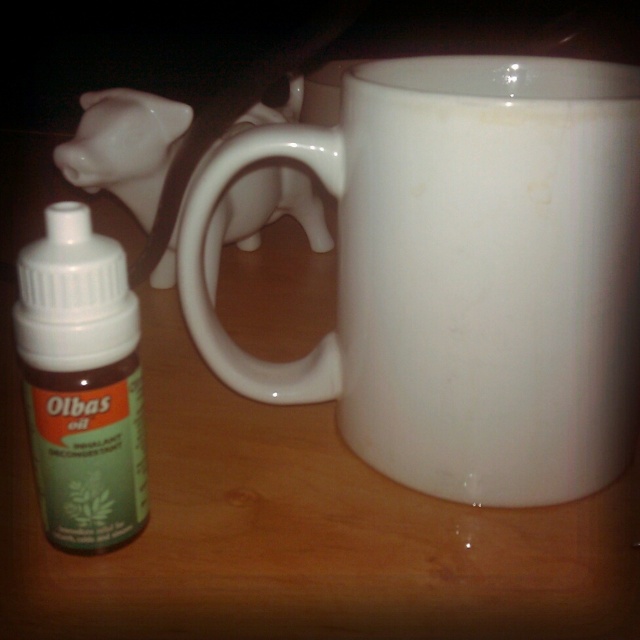
In the scene shown: You are organizing a small table and need to place the white glossy mug at center and the green matte bottle at left. According to the image, which object is placed higher than the other?

The white glossy mug at center is positioned over the green matte bottle at left, so it is higher.

You are trying to place a decorative item on the wooden surface where the white glossy mug at center is located. If you want to place it exactly at the mug position, what coordinates should you target?

You should target the coordinates at point (464, 273) where the white glossy mug at center is located.

You have a small wooden shelf that can only hold items up to the width of the green matte bottle at left. Can the white glossy mug at center fit on the shelf?

The white glossy mug at center is wider than the green matte bottle at left, so it cannot fit on the shelf designed for the bottle.